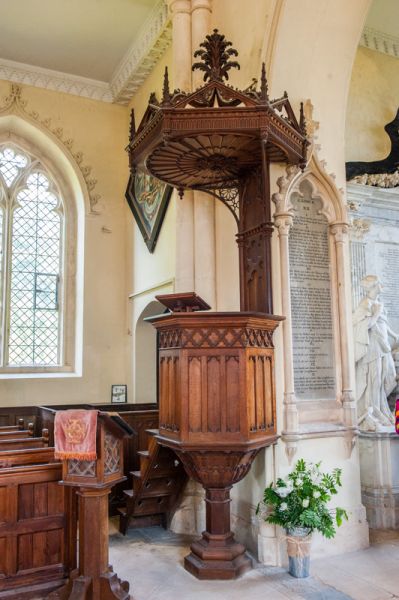
This screenshot has height=600, width=399. What are the coordinates of `bench` in the screenshot? It's located at (32, 475), (24, 458), (22, 444), (17, 434), (11, 429).